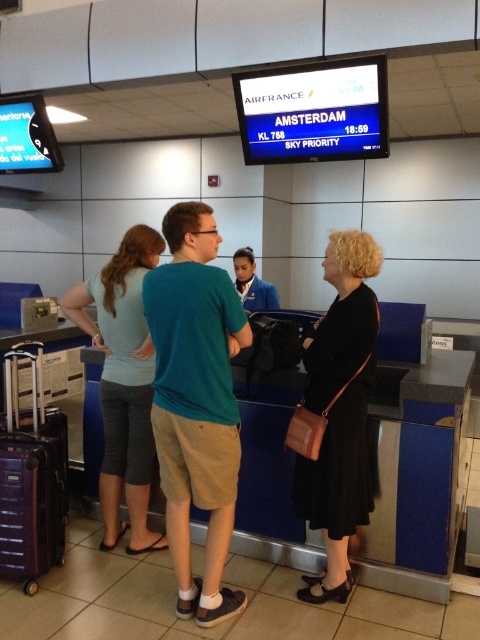
Question: Which point is farther to the camera?

Choices:
 (A) teal fabric shirt at center
 (B) black matte dress at center
 (C) light blue fabric pants at left

Answer: (C)

Question: Which point is closer to the camera?

Choices:
 (A) (331, 589)
 (B) (25, 504)
 (C) (147, 257)
 (D) (155, 291)

Answer: (D)

Question: Does black matte dress at center appear under maroon textured suitcase at lower left?

Choices:
 (A) yes
 (B) no

Answer: (B)

Question: Can you confirm if teal fabric shirt at center is thinner than maroon textured suitcase at lower left?

Choices:
 (A) no
 (B) yes

Answer: (A)

Question: Which point appears farthest from the camera in this image?

Choices:
 (A) (217, 241)
 (B) (16, 540)

Answer: (B)

Question: Is teal fabric shirt at center positioned behind light blue fabric pants at left?

Choices:
 (A) yes
 (B) no

Answer: (B)